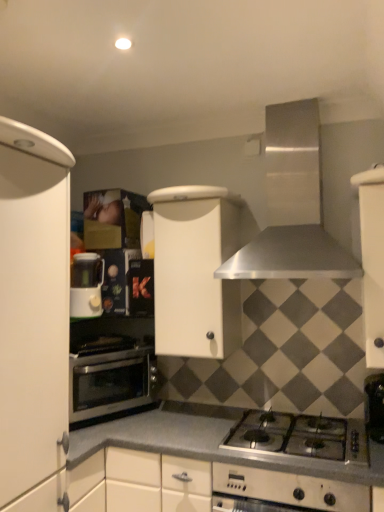
Question: Is smooth gray countertop at center situated inside white plastic coffee machine at left or outside?

Choices:
 (A) outside
 (B) inside

Answer: (A)

Question: In terms of size, does smooth gray countertop at center appear bigger or smaller than white plastic coffee machine at left?

Choices:
 (A) big
 (B) small

Answer: (A)

Question: Estimate the real-world distances between objects in this image. Which object is closer to the white matte cabinet at center, the second cabinetry when ordered from right to left?

Choices:
 (A) white matte cabinet at right, marked as the 3th cabinetry in a left-to-right arrangement
 (B) stainless steel range hood at upper center
 (C) smooth gray countertop at center
 (D) silver metallic gas stove at lower center
 (E) white plastic coffee machine at left

Answer: (B)

Question: Which object is positioned closest to the silver metallic gas stove at lower center?

Choices:
 (A) white matte cabinet at center, placed as the 2th cabinetry when sorted from left to right
 (B) smooth gray countertop at center
 (C) stainless steel oven at lower left
 (D) white plastic coffee machine at left
 (E) white matte cabinet at left, the 3th cabinetry when ordered from right to left

Answer: (B)